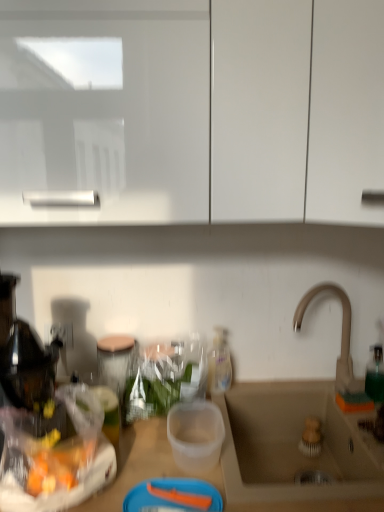
Question: Is beige ceramic sink at lower right far away from white glossy cabinet at upper center?

Choices:
 (A) yes
 (B) no

Answer: (B)

Question: Considering the relative positions of beige ceramic sink at lower right and white glossy cabinet at upper center in the image provided, is beige ceramic sink at lower right to the right of white glossy cabinet at upper center from the viewer's perspective?

Choices:
 (A) no
 (B) yes

Answer: (B)

Question: Can you confirm if beige ceramic sink at lower right is positioned to the left of white glossy cabinet at upper center?

Choices:
 (A) yes
 (B) no

Answer: (B)

Question: From the image's perspective, is beige ceramic sink at lower right located above white glossy cabinet at upper center?

Choices:
 (A) no
 (B) yes

Answer: (A)

Question: Does beige ceramic sink at lower right have a larger size compared to white glossy cabinet at upper center?

Choices:
 (A) no
 (B) yes

Answer: (A)

Question: In the image, is beige ceramic sink at lower right positioned in front of or behind satin nickel faucet at sink right?

Choices:
 (A) behind
 (B) front

Answer: (B)

Question: Is beige ceramic sink at lower right bigger or smaller than satin nickel faucet at sink right?

Choices:
 (A) small
 (B) big

Answer: (B)

Question: In terms of height, does beige ceramic sink at lower right look taller or shorter compared to satin nickel faucet at sink right?

Choices:
 (A) tall
 (B) short

Answer: (B)

Question: From the image's perspective, is beige ceramic sink at lower right located above or below satin nickel faucet at sink right?

Choices:
 (A) above
 (B) below

Answer: (B)

Question: Is beige ceramic sink at lower right in front of or behind translucent plastic bottle at center in the image?

Choices:
 (A) front
 (B) behind

Answer: (A)

Question: Is beige ceramic sink at lower right inside the boundaries of translucent plastic bottle at center, or outside?

Choices:
 (A) inside
 (B) outside

Answer: (B)

Question: Based on their positions, is beige ceramic sink at lower right located to the left or right of translucent plastic bottle at center?

Choices:
 (A) left
 (B) right

Answer: (B)

Question: From the image's perspective, is beige ceramic sink at lower right above or below translucent plastic bottle at center?

Choices:
 (A) below
 (B) above

Answer: (A)

Question: Considering the positions of translucent plastic bottle at center and beige ceramic sink at lower right in the image, is translucent plastic bottle at center taller or shorter than beige ceramic sink at lower right?

Choices:
 (A) short
 (B) tall

Answer: (B)

Question: In the image, is translucent plastic bottle at center positioned in front of or behind beige ceramic sink at lower right?

Choices:
 (A) front
 (B) behind

Answer: (B)